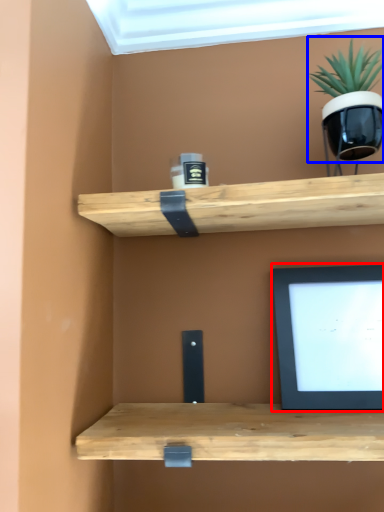
Question: Which object is closer to the camera taking this photo, computer monitor (highlighted by a red box) or houseplant (highlighted by a blue box)?

Choices:
 (A) computer monitor
 (B) houseplant

Answer: (B)